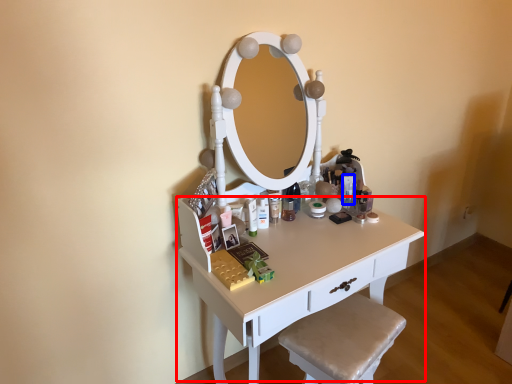
Question: Which object is closer to the camera taking this photo, table (highlighted by a red box) or toiletry (highlighted by a blue box)?

Choices:
 (A) table
 (B) toiletry

Answer: (A)